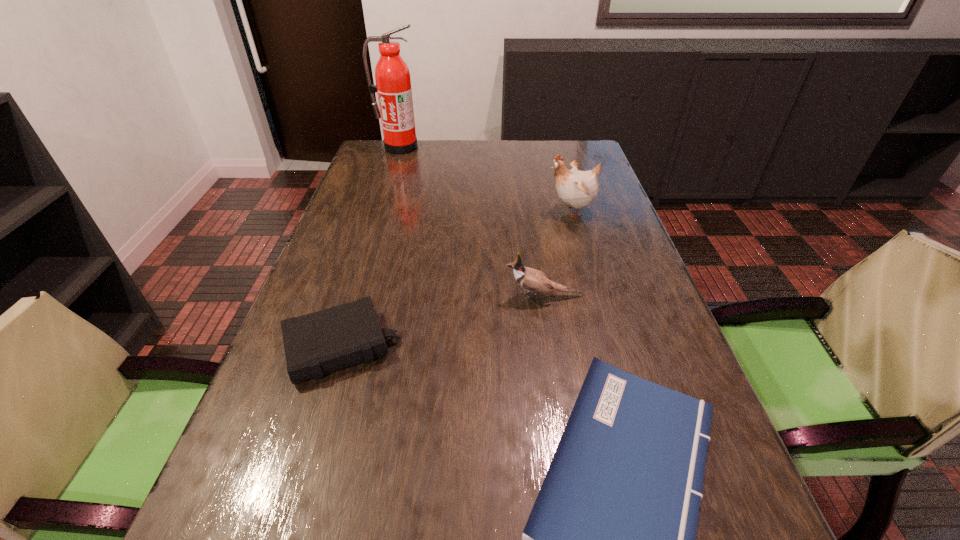
The height and width of the screenshot is (540, 960). Find the location of `vacant space located at the beak of the fourth shortest object`. vacant space located at the beak of the fourth shortest object is located at coordinates (491, 211).

Find the location of a particular element. Image resolution: width=960 pixels, height=540 pixels. vacant space located at the face of the third farthest object is located at coordinates (483, 296).

In order to click on vacant space located 0.140m at the face of the third farthest object in this screenshot , I will do `click(444, 296)`.

Where is `free location located 0.100m at the face of the third farthest object`? free location located 0.100m at the face of the third farthest object is located at coordinates (461, 296).

You are a GUI agent. You are given a task and a screenshot of the screen. Output one action in this format:
    pyautogui.click(x=<x>, y=<y>)
    Task: Click on the free space located on the right of the Bible
    The image size is (960, 540).
    Given the screenshot: What is the action you would take?
    pyautogui.click(x=473, y=346)

Image resolution: width=960 pixels, height=540 pixels. I want to click on object present at the far edge, so click(393, 84).

Locate an element on the screen. fire extinguisher positioned at the left edge is located at coordinates (393, 84).

The height and width of the screenshot is (540, 960). I want to click on Bible situated at the left edge, so click(328, 340).

Identify the location of object that is at the right edge. (575, 188).

Find the location of `object located at the far left corner`. object located at the far left corner is located at coordinates (393, 84).